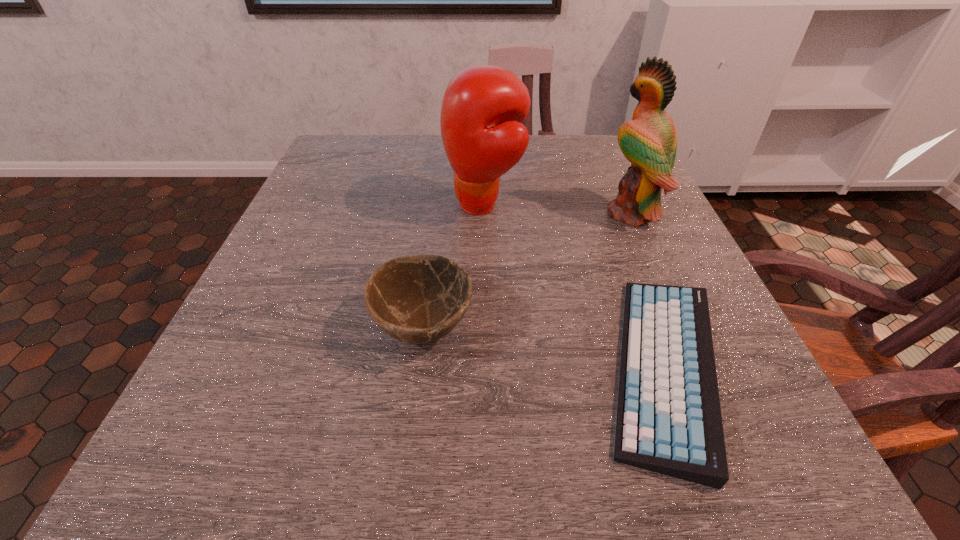
This screenshot has height=540, width=960. In order to click on vacant space at the near left corner in this screenshot , I will do `click(258, 465)`.

At what (x,y) coordinates should I click in order to perform the action: click on unoccupied area between the boxing glove and the computer keyboard. Please return your answer as a coordinate pair (x, y). Looking at the image, I should click on (574, 287).

Locate an element on the screen. The height and width of the screenshot is (540, 960). vacant space in between the boxing glove and the parrot is located at coordinates click(558, 209).

This screenshot has height=540, width=960. I want to click on empty location between the parrot and the bowl, so click(x=527, y=270).

Where is `vacant space in between the computer keyboard and the third tallest object`? The image size is (960, 540). vacant space in between the computer keyboard and the third tallest object is located at coordinates (543, 347).

Image resolution: width=960 pixels, height=540 pixels. What are the coordinates of `free space between the computer keyboard and the third tallest object` in the screenshot? It's located at (543, 347).

In order to click on free spot between the shortest object and the bowl in this screenshot , I will do `click(543, 347)`.

You are a GUI agent. You are given a task and a screenshot of the screen. Output one action in this format:
    pyautogui.click(x=<x>, y=<y>)
    Task: Click on the free spot between the boxing glove and the computer keyboard
    The image size is (960, 540).
    Given the screenshot: What is the action you would take?
    pyautogui.click(x=574, y=287)

The image size is (960, 540). Find the location of `the closest object to the parrot`. the closest object to the parrot is located at coordinates (669, 421).

Where is `object that is the closest one to the shortest object`? object that is the closest one to the shortest object is located at coordinates (649, 141).